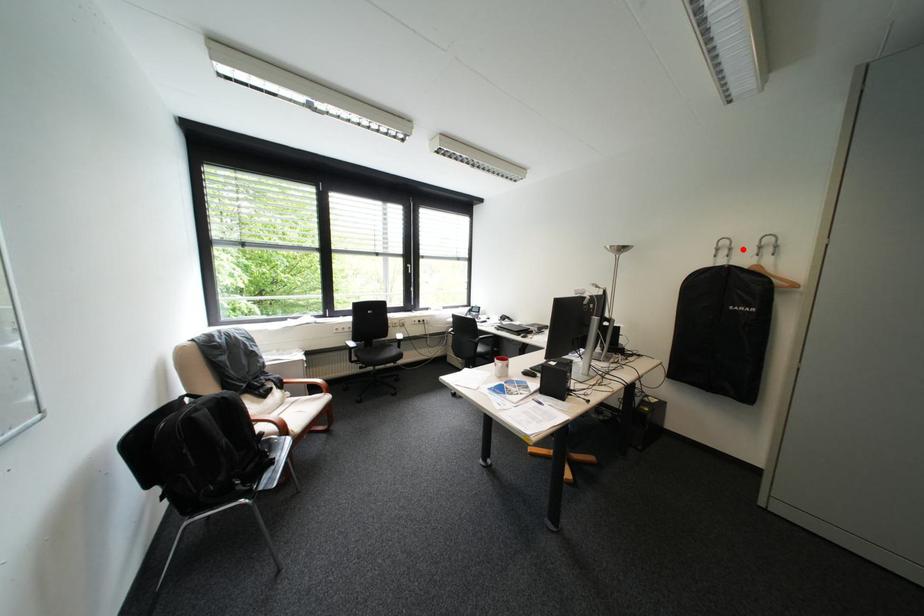
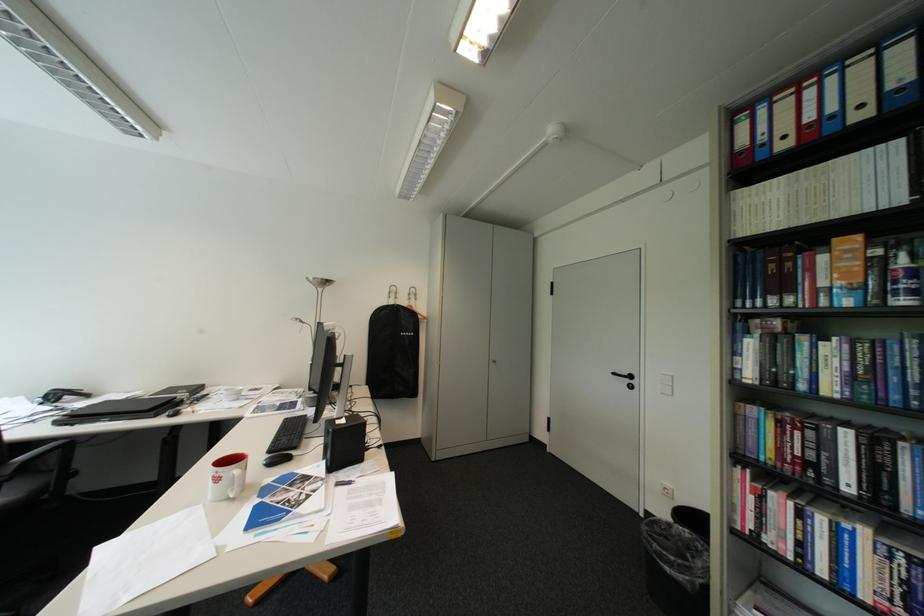
Find the pixel in the second image that matches the highlighted location in the first image.

(408, 294)